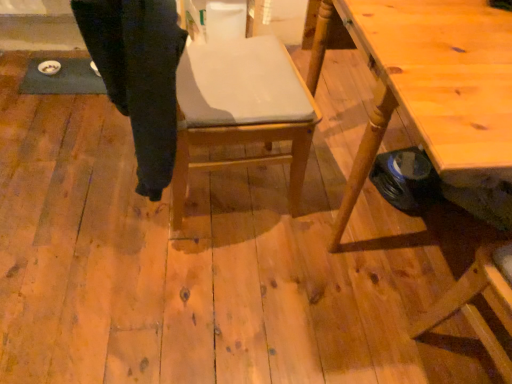
Question: From their relative heights in the image, would you say wooden chair at center is taller or shorter than wooden table at right?

Choices:
 (A) tall
 (B) short

Answer: (A)

Question: From the image's perspective, is wooden chair at center above or below wooden table at right?

Choices:
 (A) below
 (B) above

Answer: (B)

Question: Estimate the real-world distances between objects in this image. Which object is closer to the black cotton trousers at center?

Choices:
 (A) wooden table at right
 (B) wooden chair at center

Answer: (B)

Question: Based on their relative distances, which object is farther from the wooden chair at center?

Choices:
 (A) black cotton trousers at center
 (B) wooden table at right

Answer: (B)